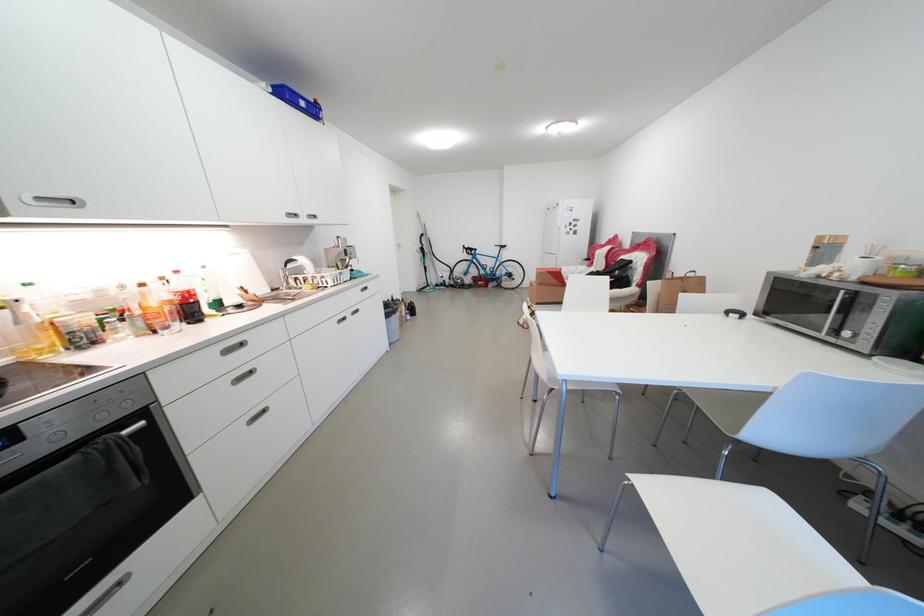
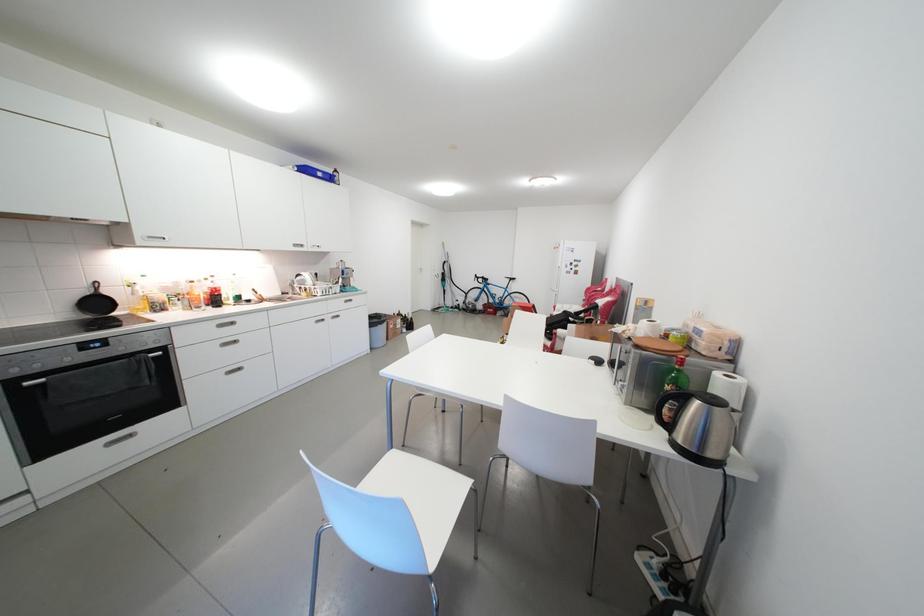
Question: Which direction would the cameraman need to move to produce the second image? Reply with the corresponding letter.

Choices:
 (A) Left
 (B) Right
 (C) Forward
 (D) Backward

Answer: (B)